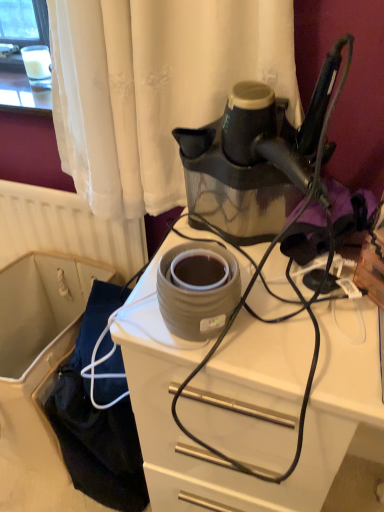
Question: Is matte gray ceramic pot at center facing towards black rubber cord at center?

Choices:
 (A) yes
 (B) no

Answer: (B)

Question: Is matte gray ceramic pot at center positioned behind black rubber cord at center?

Choices:
 (A) no
 (B) yes

Answer: (B)

Question: Is matte gray ceramic pot at center outside black rubber cord at center?

Choices:
 (A) no
 (B) yes

Answer: (B)

Question: Is black rubber cord at center located within matte gray ceramic pot at center?

Choices:
 (A) no
 (B) yes

Answer: (A)

Question: From a real-world perspective, does matte gray ceramic pot at center sit lower than black rubber cord at center?

Choices:
 (A) yes
 (B) no

Answer: (A)

Question: Is matte gray ceramic pot at center positioned in front of black rubber cord at center?

Choices:
 (A) no
 (B) yes

Answer: (A)

Question: Does black rubber cord at center come in front of matte gray ceramic pot at center?

Choices:
 (A) no
 (B) yes

Answer: (B)

Question: Can you confirm if black rubber cord at center is taller than matte gray ceramic pot at center?

Choices:
 (A) yes
 (B) no

Answer: (A)

Question: Is black rubber cord at center oriented towards matte gray ceramic pot at center?

Choices:
 (A) no
 (B) yes

Answer: (B)

Question: Can you confirm if black rubber cord at center is positioned to the right of matte gray ceramic pot at center?

Choices:
 (A) yes
 (B) no

Answer: (A)

Question: From a real-world perspective, is black rubber cord at center on matte gray ceramic pot at center?

Choices:
 (A) yes
 (B) no

Answer: (A)

Question: Could matte gray ceramic pot at center be considered to be inside black rubber cord at center?

Choices:
 (A) yes
 (B) no

Answer: (B)

Question: Is matte gray ceramic at center next to black rubber cord at center?

Choices:
 (A) no
 (B) yes

Answer: (B)